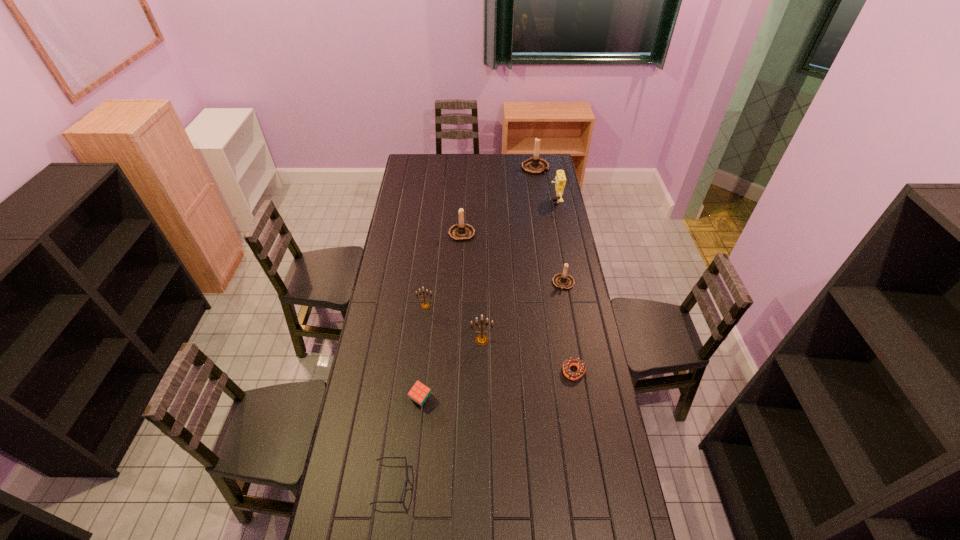
Locate an element on the screen. This screenshot has height=540, width=960. free space between the nearest brown candle holder and the bigger gold candelabrum is located at coordinates (522, 312).

The width and height of the screenshot is (960, 540). Identify the location of unoccupied area between the tallest candelabrum and the second farthest brown candle holder. (498, 200).

Choose which object is the fifth nearest neighbor to the brown doughnut. Please provide its 2D coordinates. Your answer should be formatted as a tuple, i.e. [(x, y)], where the tuple contains the x and y coordinates of a point satisfying the conditions above.

[(407, 480)]

The image size is (960, 540). In order to click on object that is the sixth closest to the smaller gold candelabrum in this screenshot , I will do `click(407, 480)`.

Choose which candelabrum is the nearest neighbor to the leftmost candelabrum. Please provide its 2D coordinates. Your answer should be formatted as a tuple, i.e. [(x, y)], where the tuple contains the x and y coordinates of a point satisfying the conditions above.

[(481, 340)]

At what (x,y) coordinates should I click in order to perform the action: click on candelabrum that stands as the second closest to the smallest brown candle holder. Please return your answer as a coordinate pair (x, y). The height and width of the screenshot is (540, 960). Looking at the image, I should click on (461, 232).

Locate which brown candle holder is the third closest to the red cube. Please provide its 2D coordinates. Your answer should be formatted as a tuple, i.e. [(x, y)], where the tuple contains the x and y coordinates of a point satisfying the conditions above.

[(535, 166)]

The image size is (960, 540). I want to click on brown candle holder identified as the second closest to the eighth nearest object, so click(461, 232).

Locate an element on the screen. free location that satisfies the following two spatial constraints: 1. on the back side of the nearest brown candle holder; 2. on the right side of the fourth nearest object is located at coordinates (482, 284).

Find the location of `free location that satisfies the following two spatial constraints: 1. on the back side of the third farthest candelabrum; 2. on the right side of the smaller gold candelabrum`. free location that satisfies the following two spatial constraints: 1. on the back side of the third farthest candelabrum; 2. on the right side of the smaller gold candelabrum is located at coordinates (428, 284).